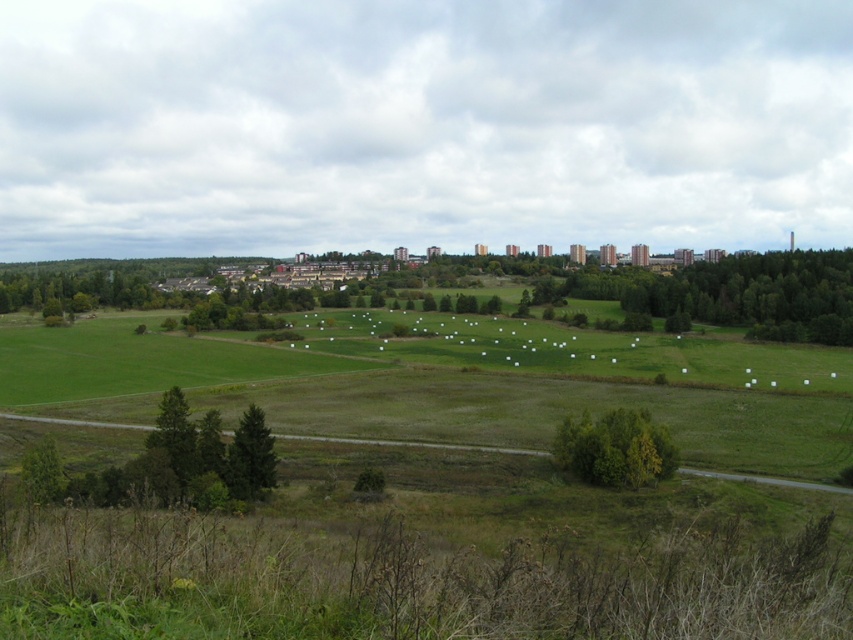
Does green matte tree at lower left have a larger size compared to green leafy tree at lower left?

Incorrect, green matte tree at lower left is not larger than green leafy tree at lower left.

Which is in front, point (251, 404) or point (53, 461)?

Point (53, 461)

At what (x,y) coordinates should I click in order to perform the action: click on green matte tree at lower left. Please return your answer as a coordinate pair (x, y). Looking at the image, I should click on (250, 456).

Is green matte trees at lower left behind green leafy tree at lower left?

That is False.

Is point (215, 464) farther from viewer compared to point (39, 467)?

Yes, point (215, 464) is behind point (39, 467).

You are a GUI agent. You are given a task and a screenshot of the screen. Output one action in this format:
    pyautogui.click(x=<x>, y=<y>)
    Task: Click on the green matte trees at lower left
    
    Given the screenshot: What is the action you would take?
    pyautogui.click(x=189, y=460)

Is point (167, 465) positioned in front of point (578, 442)?

Yes, it is.

Can you confirm if green matte trees at lower left is positioned to the left of green leafy tree at center?

Indeed, green matte trees at lower left is positioned on the left side of green leafy tree at center.

Measure the distance between green matte trees at lower left and camera.

green matte trees at lower left is 7.46 meters away from camera.

Where is `green matte trees at lower left`? Image resolution: width=853 pixels, height=640 pixels. green matte trees at lower left is located at coordinates (189, 460).